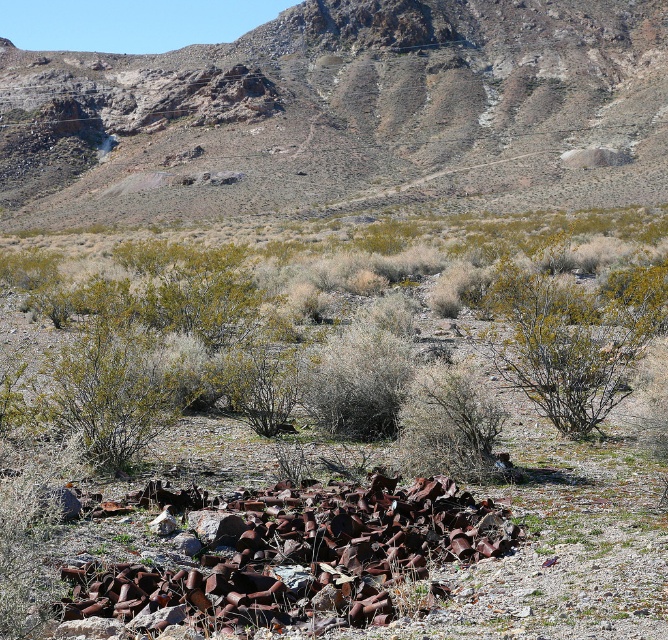
You are a hiker trying to navigate through this desert area. You see the rusty metal mountain at upper center and the green shrubs at center. Which one is higher in elevation?

The rusty metal mountain at upper center is taller than the green shrubs at center, so the rusty metal mountain at upper center is higher in elevation.

You are standing at point (347, 113) in the arid landscape. What object is located exactly at your current position?

At point (347, 113) lies rusty metal mountain at upper center.